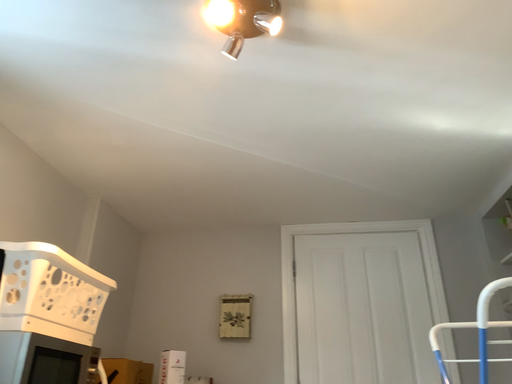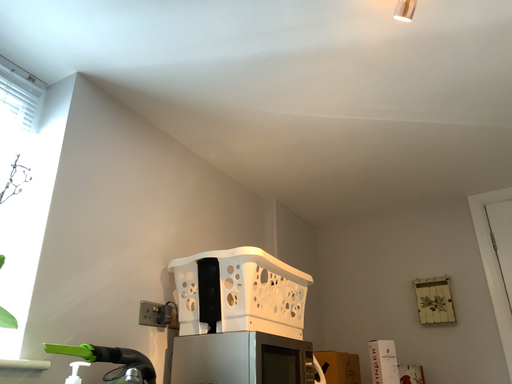
Question: How did the camera likely rotate when shooting the video?

Choices:
 (A) rotated right
 (B) rotated left

Answer: (B)